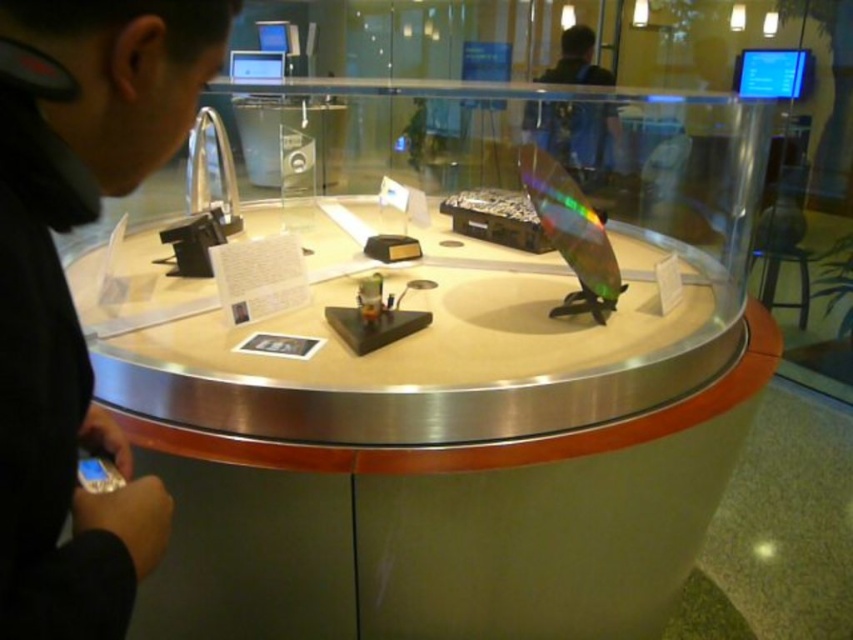
Does matte silver table at center have a greater height compared to dark blue shirt at upper center?

Correct, matte silver table at center is much taller as dark blue shirt at upper center.

Is point (646, 305) in front of point (589, 148)?

Yes, point (646, 305) is closer to viewer.

Which is in front, point (314, 632) or point (563, 54)?

Point (314, 632)

This screenshot has height=640, width=853. Identify the location of matte silver table at center. (440, 451).

Does point (206, 573) lie behind point (80, 22)?

Yes, it is.

The width and height of the screenshot is (853, 640). Describe the element at coordinates (440, 451) in the screenshot. I see `matte silver table at center` at that location.

Does point (529, 310) lie behind point (64, 339)?

Yes, point (529, 310) is behind point (64, 339).

Locate an element on the screen. This screenshot has height=640, width=853. matte silver table at center is located at coordinates [440, 451].

Does black matte phone at left have a smaller size compared to dark blue shirt at upper center?

Indeed, black matte phone at left has a smaller size compared to dark blue shirt at upper center.

Does black matte phone at left have a greater height compared to dark blue shirt at upper center?

No, black matte phone at left is not taller than dark blue shirt at upper center.

Which is behind, point (67, 20) or point (546, 147)?

The point (546, 147) is behind.

Find the location of a particular element. This screenshot has width=853, height=640. black matte phone at left is located at coordinates (68, 292).